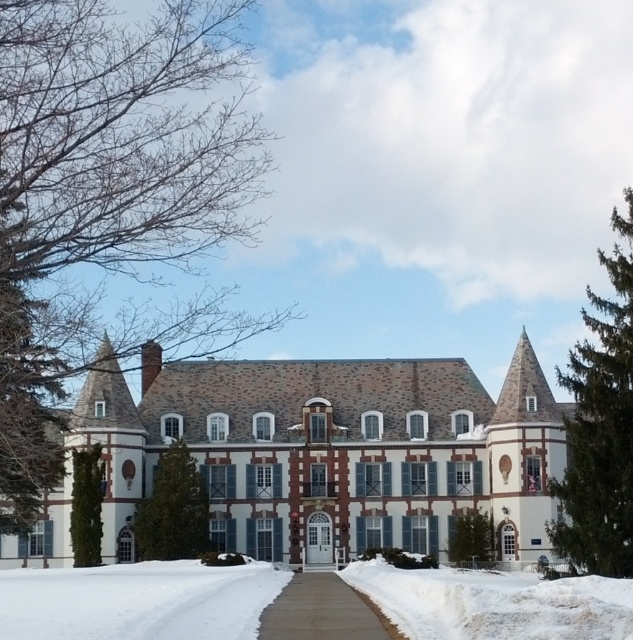
You are standing on the gray concrete sidewalk at center and looking towards the grand building. Which direction should you look to see the brown textured tree at upper left?

The brown textured tree at upper left is located above the gray concrete sidewalk at center, so you should look upwards to see it.

You are standing at the point marked as point [624,579] and want to walk to the entrance of the grand building. Considering the snowbanks on both sides of the pathway, will you be able to walk straight to the entrance without stepping on the snow?

The distance between the point marked as point [624,579] and the entrance is 86.47 meters. Since the pathway is wide and paved, and the snowbanks are on the sides, you can walk straight to the entrance without stepping on the snow.